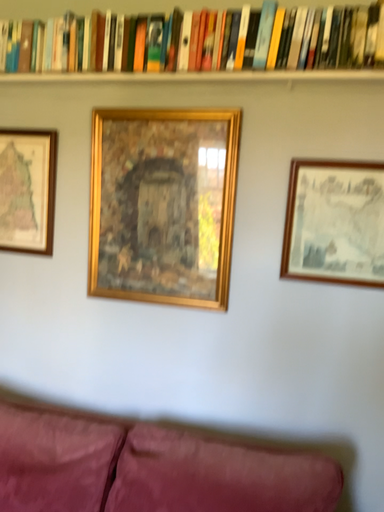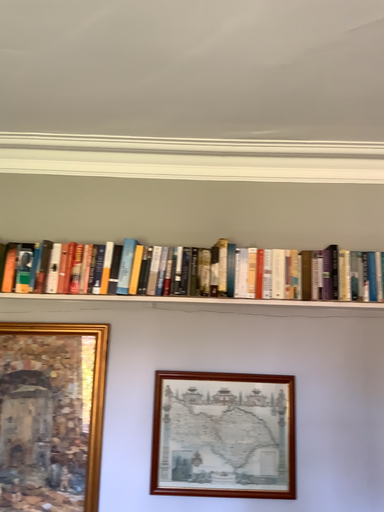
Question: How did the camera likely rotate when shooting the video?

Choices:
 (A) rotated downward
 (B) rotated upward

Answer: (B)